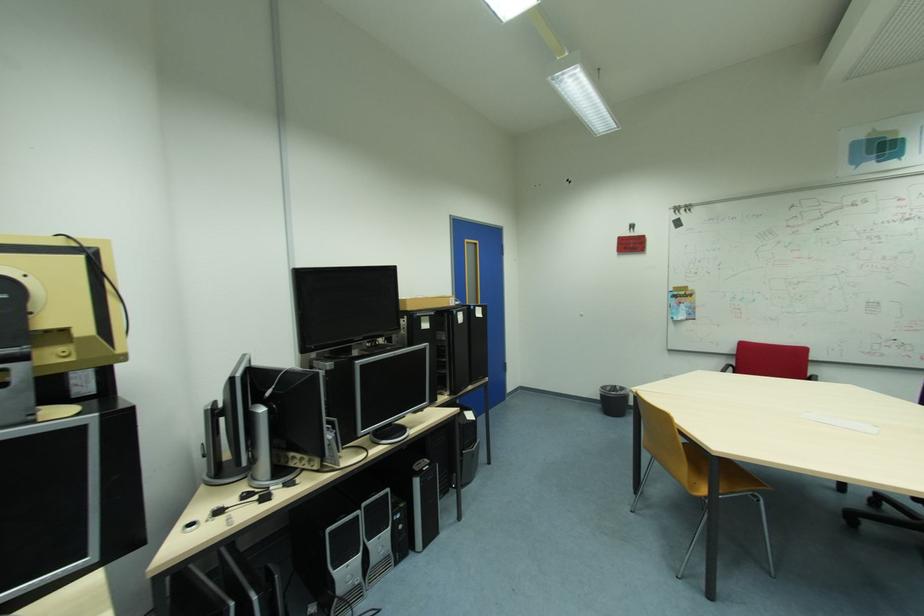
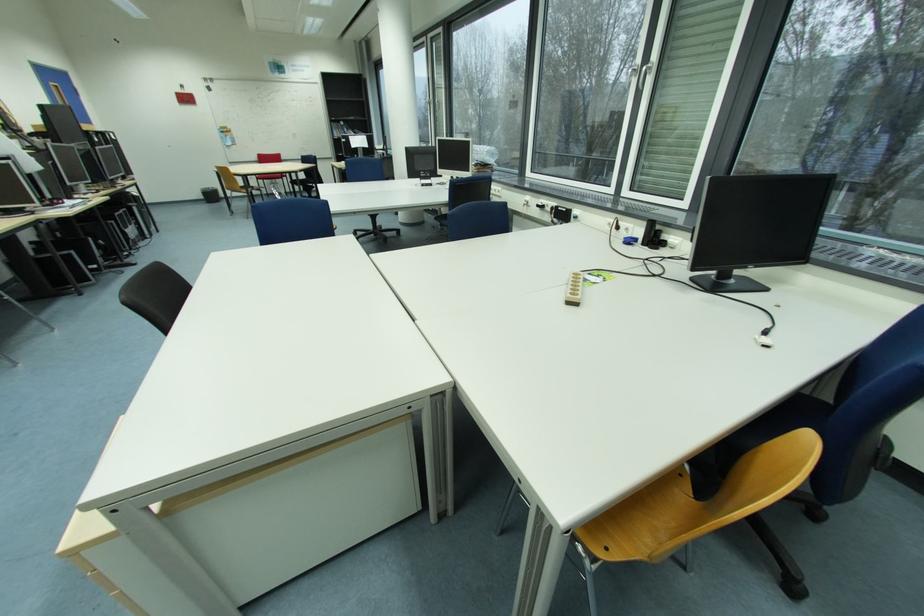
Question: I am providing you with two images of the same scene from different viewpoints. After the viewpoint changes to image2, which objects are now occluded?

Choices:
 (A) small trash can
 (B) yellow chair sitting surface
 (C) blue chair sitting surface
 (D) none of these

Answer: (D)